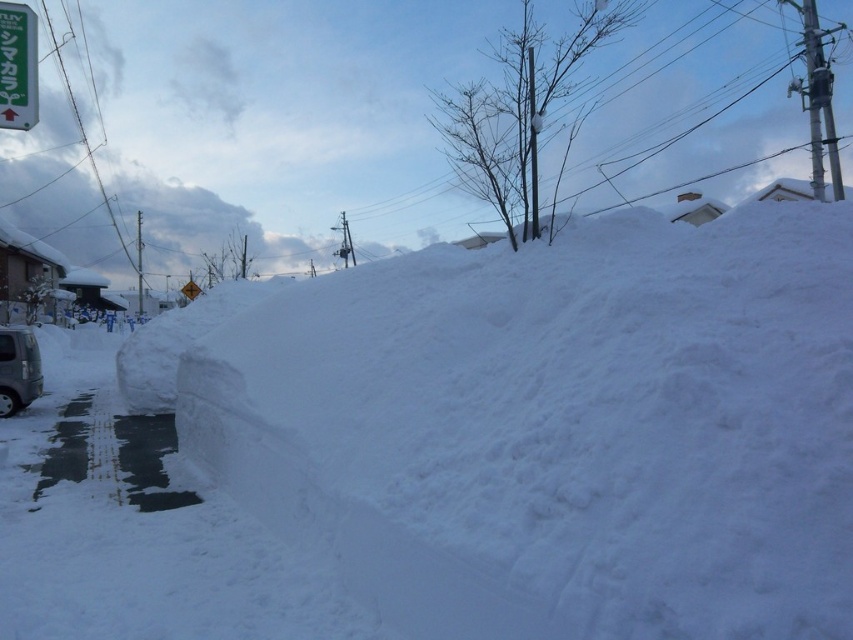
Question: Is green plastic sign at upper left thinner than metallic silver car at lower left?

Choices:
 (A) no
 (B) yes

Answer: (A)

Question: Does metallic silver car at lower left appear on the left side of metallic green sign at upper left?

Choices:
 (A) no
 (B) yes

Answer: (A)

Question: Which point is closer to the camera?

Choices:
 (A) metallic silver car at lower left
 (B) metallic green sign at upper left
 (C) green plastic sign at upper left

Answer: (C)

Question: Which is farther from the white fluffy snow at center?

Choices:
 (A) metallic green sign at upper left
 (B) green plastic sign at upper left
 (C) metallic silver car at lower left

Answer: (A)

Question: Is the position of metallic silver car at lower left less distant than that of metallic green sign at upper left?

Choices:
 (A) no
 (B) yes

Answer: (B)

Question: Which of the following is the closest to the observer?

Choices:
 (A) (10, 28)
 (B) (184, 296)

Answer: (A)